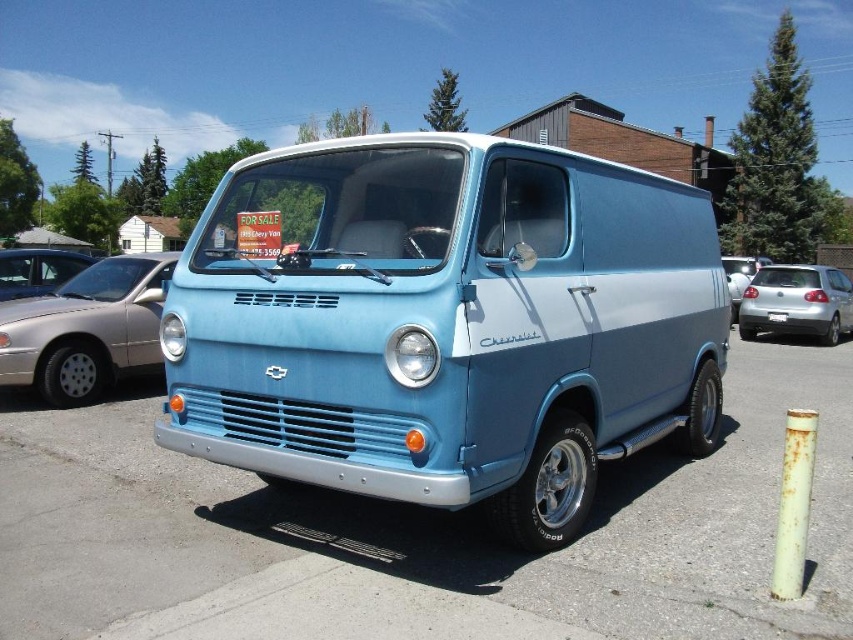
What is the color of the car located at point (x=38, y=269)?

The car at point (x=38, y=269) is matte silver.

You are a potential buyer looking at the vintage Chevrolet van. You notice the matte silver car at left and the black plastic license plate at center. Which object is closer to the front of the van?

The matte silver car at left is positioned over the black plastic license plate at center, meaning it is closer to the front of the van.